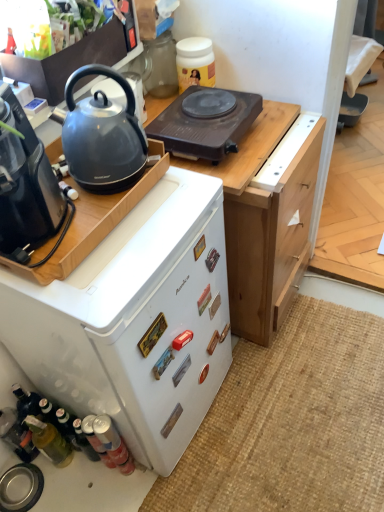
Identify the location of white matte refrigerator at center-left. (135, 321).

Describe the element at coordinates (135, 321) in the screenshot. The height and width of the screenshot is (512, 384). I see `white matte refrigerator at center-left` at that location.

Measure the distance between translucent glass bottle at lower left and camera.

translucent glass bottle at lower left and camera are 4.33 feet apart.

The width and height of the screenshot is (384, 512). Describe the element at coordinates (20, 487) in the screenshot. I see `metallic silver sink at lower left, the 3th kitchen appliance in the top-to-bottom sequence` at that location.

Where is `black plastic coffee maker at left`? black plastic coffee maker at left is located at coordinates (25, 182).

Where is `satin black kettle at upper left, which appears as the first kitchen appliance when viewed from the top`? satin black kettle at upper left, which appears as the first kitchen appliance when viewed from the top is located at coordinates (73, 58).

Where is `white matte refrigerator at center-left`? The image size is (384, 512). white matte refrigerator at center-left is located at coordinates (135, 321).

From the image's perspective, is brown plastic electric hot plate at upper center below burlap mat at lower right?

Incorrect, from the image's perspective, brown plastic electric hot plate at upper center is higher than burlap mat at lower right.

Based on the photo, can you confirm if brown plastic electric hot plate at upper center is smaller than burlap mat at lower right?

Yes, brown plastic electric hot plate at upper center is smaller than burlap mat at lower right.

What's the angular difference between brown plastic electric hot plate at upper center and burlap mat at lower right's facing directions?

The angle between the facing direction of brown plastic electric hot plate at upper center and the facing direction of burlap mat at lower right is 87.1 degrees.

From a real-world perspective, is brown plastic electric hot plate at upper center on burlap mat at lower right?

Yes, from a real-world perspective, brown plastic electric hot plate at upper center is over burlap mat at lower right

From the image's perspective, which kitchen appliance is the 1st one above the burlap mat at lower right? Please provide its 2D coordinates.

[(93, 222)]

Is the surface of matte black coffee maker at left, which ranks as the 2th kitchen appliance in top-to-bottom order, in direct contact with burlap mat at lower right?

They are not placed beside each other.

Is point (160, 110) closer or farther from the camera than point (302, 320)?

Clearly, point (160, 110) is closer to the camera than point (302, 320).

Which is less distant, [245,101] or [86,200]?

Point [86,200]

From a real-world perspective, is brown plastic electric hot plate at upper center positioned above or below matte black coffee maker at left, which ranks as the 2th kitchen appliance in top-to-bottom order?

Clearly, from a real-world perspective, brown plastic electric hot plate at upper center is below matte black coffee maker at left, which ranks as the 2th kitchen appliance in top-to-bottom order.

Is brown plastic electric hot plate at upper center facing towards matte black coffee maker at left, acting as the second kitchen appliance starting from the bottom?

No, brown plastic electric hot plate at upper center is not aimed at matte black coffee maker at left, acting as the second kitchen appliance starting from the bottom.

From the image's perspective, is brown plastic electric hot plate at upper center located above matte black coffee maker at left, acting as the second kitchen appliance starting from the bottom?

Yes, from the image's perspective, brown plastic electric hot plate at upper center is over matte black coffee maker at left, acting as the second kitchen appliance starting from the bottom.

The width and height of the screenshot is (384, 512). Find the location of `gas stove that appears above the black plastic coffee maker at left (from the image's perspective)`. gas stove that appears above the black plastic coffee maker at left (from the image's perspective) is located at coordinates (205, 124).

Which is in front, black plastic coffee maker at left or brown plastic electric hot plate at upper center?

Positioned in front is black plastic coffee maker at left.

Does black plastic coffee maker at left touch brown plastic electric hot plate at upper center?

No, black plastic coffee maker at left is not next to brown plastic electric hot plate at upper center.

From the image's perspective, between black plastic coffee maker at left and brown plastic electric hot plate at upper center, which one is located above?

brown plastic electric hot plate at upper center is shown above in the image.

Does metallic silver sink at lower left, the 3th kitchen appliance in the top-to-bottom sequence, have a smaller size compared to matte black coffee maker at left, which ranks as the 2th kitchen appliance in top-to-bottom order?

Yes, metallic silver sink at lower left, the 3th kitchen appliance in the top-to-bottom sequence, is smaller than matte black coffee maker at left, which ranks as the 2th kitchen appliance in top-to-bottom order.

Find the location of `kitchen appliance below the matte black coffee maker at left, which ranks as the 2th kitchen appliance in top-to-bottom order (from a real-world perspective)`. kitchen appliance below the matte black coffee maker at left, which ranks as the 2th kitchen appliance in top-to-bottom order (from a real-world perspective) is located at coordinates (20, 487).

How different are the orientations of metallic silver sink at lower left, the 3th kitchen appliance in the top-to-bottom sequence, and matte black coffee maker at left, which ranks as the 2th kitchen appliance in top-to-bottom order, in degrees?

There is a 1.9-degree angle between the facing directions of metallic silver sink at lower left, the 3th kitchen appliance in the top-to-bottom sequence, and matte black coffee maker at left, which ranks as the 2th kitchen appliance in top-to-bottom order.

Between metallic silver sink at lower left, the 1th kitchen appliance ordered from the bottom, and matte black coffee maker at left, acting as the second kitchen appliance starting from the bottom, which one has smaller width?

metallic silver sink at lower left, the 1th kitchen appliance ordered from the bottom, is thinner.

Is translucent glass bottle at lower left to the right of white matte refrigerator at center-left from the viewer's perspective?

No.

From their relative heights in the image, would you say translucent glass bottle at lower left is taller or shorter than white matte refrigerator at center-left?

Considering their sizes, translucent glass bottle at lower left has less height than white matte refrigerator at center-left.

Would you say white matte refrigerator at center-left is part of translucent glass bottle at lower left's contents?

No, white matte refrigerator at center-left is not inside translucent glass bottle at lower left.

Considering the positions of points (66, 457) and (37, 365), is point (66, 457) farther from camera compared to point (37, 365)?

Yes, point (66, 457) is farther from viewer.

Is burlap mat at lower right touching brown plastic electric hot plate at upper center?

They are not placed beside each other.

Is brown plastic electric hot plate at upper center completely or partially inside burlap mat at lower right?

That's incorrect, brown plastic electric hot plate at upper center is not inside burlap mat at lower right.

Does point (353, 400) lie in front of point (200, 97)?

No.

What's the angular difference between burlap mat at lower right and brown plastic electric hot plate at upper center's facing directions?

There is a 87.1-degree angle between the facing directions of burlap mat at lower right and brown plastic electric hot plate at upper center.

The height and width of the screenshot is (512, 384). I want to click on gas stove on the left of burlap mat at lower right, so pyautogui.click(x=205, y=124).

Image resolution: width=384 pixels, height=512 pixels. I want to click on the 1st kitchen appliance positioned above the burlap mat at lower right (from the image's perspective), so click(93, 222).

Based on their spatial positions, is black plastic coffee maker at left or matte black kettle at left further from translucent glass bottle at lower left?

matte black kettle at left.

Looking at the image, which one is located further to white matte refrigerator at center-left, translucent glass bottle at lower left or black plastic coffee maker at left?

translucent glass bottle at lower left is positioned further to the anchor white matte refrigerator at center-left.

Considering their positions, is brown plastic electric hot plate at upper center positioned further to matte black kettle at left than white matte refrigerator at center-left?

The object further to matte black kettle at left is white matte refrigerator at center-left.

When comparing their distances from black plastic coffee maker at left, does metallic silver sink at lower left, the 3th kitchen appliance in the top-to-bottom sequence, or matte black kettle at left seem further?

metallic silver sink at lower left, the 3th kitchen appliance in the top-to-bottom sequence, is positioned further to the anchor black plastic coffee maker at left.

When comparing their distances from brown plastic electric hot plate at upper center, does metallic silver sink at lower left, the 1th kitchen appliance ordered from the bottom, or burlap mat at lower right seem further?

metallic silver sink at lower left, the 1th kitchen appliance ordered from the bottom, is further to brown plastic electric hot plate at upper center.

Based on their spatial positions, is metallic silver sink at lower left, the 1th kitchen appliance ordered from the bottom, or matte black kettle at left further from satin black kettle at upper left, which appears as the first kitchen appliance when viewed from the top?

Based on the image, metallic silver sink at lower left, the 1th kitchen appliance ordered from the bottom, appears to be further to satin black kettle at upper left, which appears as the first kitchen appliance when viewed from the top.

Consider the image. Which object lies further to the anchor point metallic silver sink at lower left, the 3th kitchen appliance in the top-to-bottom sequence, burlap mat at lower right or brown plastic electric hot plate at upper center?

Among the two, brown plastic electric hot plate at upper center is located further to metallic silver sink at lower left, the 3th kitchen appliance in the top-to-bottom sequence.

Consider the image. Looking at the image, which one is located closer to burlap mat at lower right, translucent glass bottle at lower left or white matte refrigerator at center-left?

Among the two, white matte refrigerator at center-left is located nearer to burlap mat at lower right.

Locate an element on the screen. The image size is (384, 512). coffee maker between brown plastic electric hot plate at upper center and burlap mat at lower right from top to bottom is located at coordinates (25, 182).

Identify the location of kitchen appliance between matte black kettle at left and burlap mat at lower right from top to bottom. This screenshot has width=384, height=512. (93, 222).

Image resolution: width=384 pixels, height=512 pixels. I want to click on coffee maker between satin black kettle at upper left, which appears as the first kitchen appliance when viewed from the top, and white matte refrigerator at center-left from top to bottom, so click(x=25, y=182).

Find the location of a particular element. This screenshot has width=384, height=512. coffee maker between matte black kettle at left and white matte refrigerator at center-left in the vertical direction is located at coordinates (25, 182).